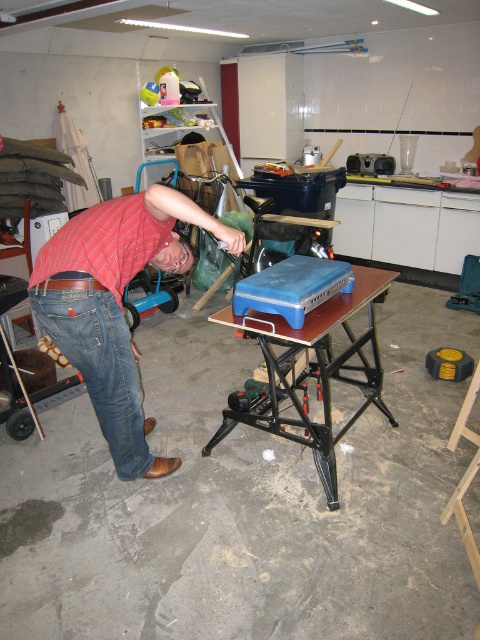
Question: Can you confirm if blue plastic table at center is smaller than denim at left?

Choices:
 (A) no
 (B) yes

Answer: (A)

Question: Is red striped shirt at lower left positioned behind denim at left?

Choices:
 (A) no
 (B) yes

Answer: (A)

Question: Can you confirm if red striped shirt at lower left is positioned above blue plastic table at center?

Choices:
 (A) yes
 (B) no

Answer: (A)

Question: Estimate the real-world distances between objects in this image. Which object is closer to the red striped shirt at lower left?

Choices:
 (A) denim at left
 (B) blue plastic table at center

Answer: (A)

Question: Which of the following is the closest to the observer?

Choices:
 (A) (269, 332)
 (B) (56, 336)

Answer: (B)

Question: Among these points, which one is farthest from the camera?

Choices:
 (A) (84, 276)
 (B) (69, 301)

Answer: (A)